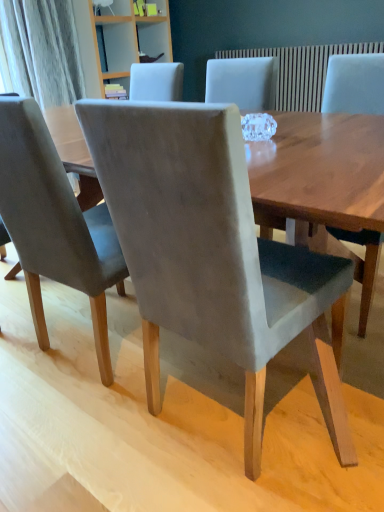
Question: Is suede gray chair at center, arranged as the 2th chair when viewed from the right, positioned beyond the bounds of suede gray chair at center, acting as the third chair starting from the right?

Choices:
 (A) yes
 (B) no

Answer: (A)

Question: Can you confirm if suede gray chair at center, the second chair in the left-to-right sequence, is thinner than suede gray chair at center, acting as the third chair starting from the right?

Choices:
 (A) no
 (B) yes

Answer: (B)

Question: Considering the relative positions of suede gray chair at center, the second chair in the left-to-right sequence, and suede gray chair at center, acting as the third chair starting from the right, in the image provided, is suede gray chair at center, the second chair in the left-to-right sequence, in front of suede gray chair at center, acting as the third chair starting from the right,?

Choices:
 (A) yes
 (B) no

Answer: (A)

Question: From the image's perspective, would you say suede gray chair at center, the second chair in the left-to-right sequence, is shown under suede gray chair at center, acting as the third chair starting from the right?

Choices:
 (A) no
 (B) yes

Answer: (B)

Question: Is suede gray chair at center, the second chair in the left-to-right sequence, far away from suede gray chair at center, the 1th chair viewed from the left?

Choices:
 (A) no
 (B) yes

Answer: (A)

Question: Does suede gray chair at center, the second chair in the left-to-right sequence, have a greater width compared to suede gray chair at center, the 1th chair viewed from the left?

Choices:
 (A) yes
 (B) no

Answer: (B)

Question: From the image's perspective, is suede gray chair at center, acting as the third chair starting from the right, on top of suede gray chair at center, arranged as the 2th chair when viewed from the right?

Choices:
 (A) yes
 (B) no

Answer: (A)

Question: Is suede gray chair at center, acting as the third chair starting from the right, thinner than suede gray chair at center, arranged as the 2th chair when viewed from the right?

Choices:
 (A) yes
 (B) no

Answer: (B)

Question: Could you tell me if suede gray chair at center, the 1th chair viewed from the left, is turned towards suede gray chair at center, arranged as the 2th chair when viewed from the right?

Choices:
 (A) no
 (B) yes

Answer: (A)

Question: Is suede gray chair at center, the 1th chair viewed from the left, turned away from suede gray chair at center, the second chair in the left-to-right sequence?

Choices:
 (A) yes
 (B) no

Answer: (B)

Question: Could suede gray chair at center, arranged as the 2th chair when viewed from the right, be considered to be inside suede gray chair at center, the 1th chair viewed from the left?

Choices:
 (A) no
 (B) yes

Answer: (A)

Question: From a real-world perspective, is suede gray chair at center, acting as the third chair starting from the right, on suede gray chair at center, arranged as the 2th chair when viewed from the right?

Choices:
 (A) yes
 (B) no

Answer: (A)

Question: Does suede gray chair at center, the second chair in the left-to-right sequence, have a lesser width compared to velvet gray chair at center, the first chair from the right?

Choices:
 (A) yes
 (B) no

Answer: (B)